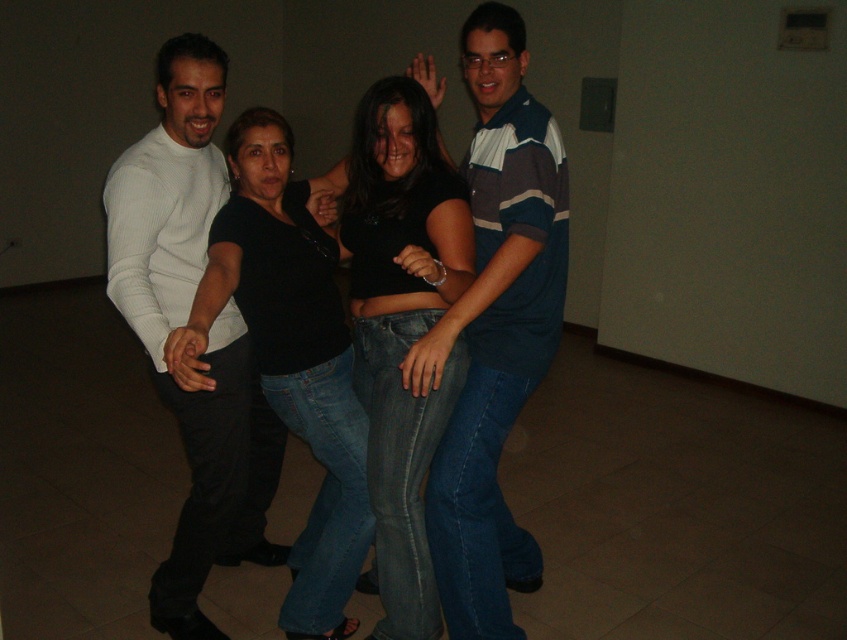
Question: Does striped cotton shirt at center appear on the left side of black matte shirt at center?

Choices:
 (A) no
 (B) yes

Answer: (A)

Question: Which object is the farthest from the striped cotton shirt at center?

Choices:
 (A) black denim jeans at center
 (B) black matte shirt at center

Answer: (B)

Question: Which point is farther to the camera?

Choices:
 (A) (477, 109)
 (B) (472, 244)
 (C) (152, 202)

Answer: (A)

Question: Is striped cotton shirt at center above black denim jeans at center?

Choices:
 (A) yes
 (B) no

Answer: (A)

Question: Does white ribbed sweater at left appear under black matte shirt at center?

Choices:
 (A) yes
 (B) no

Answer: (B)

Question: Which point is farther from the camera taking this photo?

Choices:
 (A) (342, 628)
 (B) (468, 502)
 (C) (181, 76)

Answer: (A)